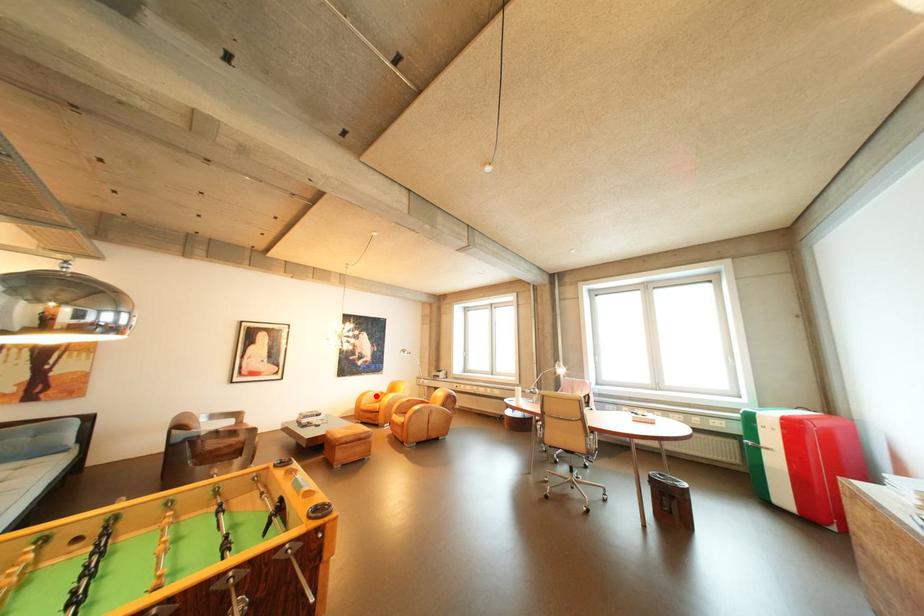
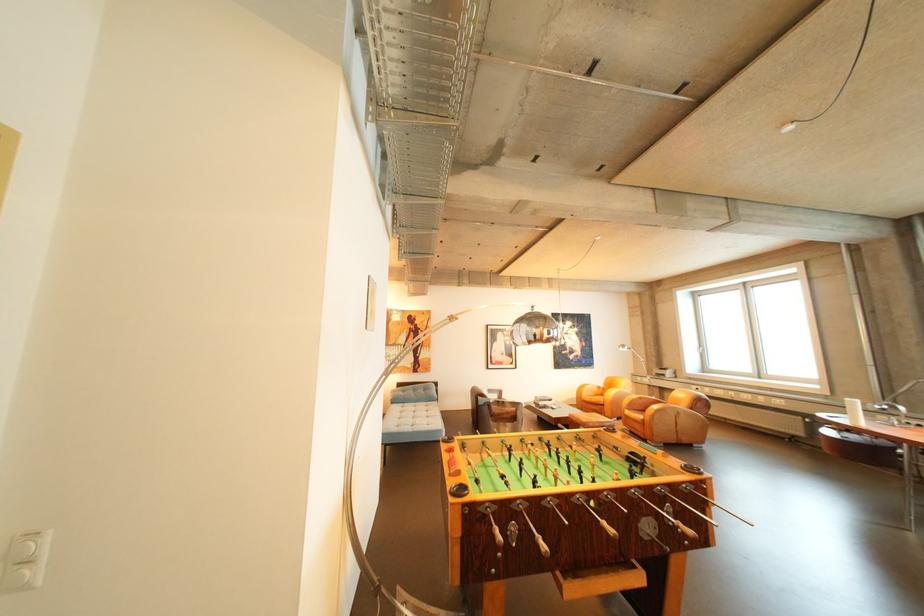
Where in the second image is the point corresponding to the highlighted location from the first image?

(594, 387)